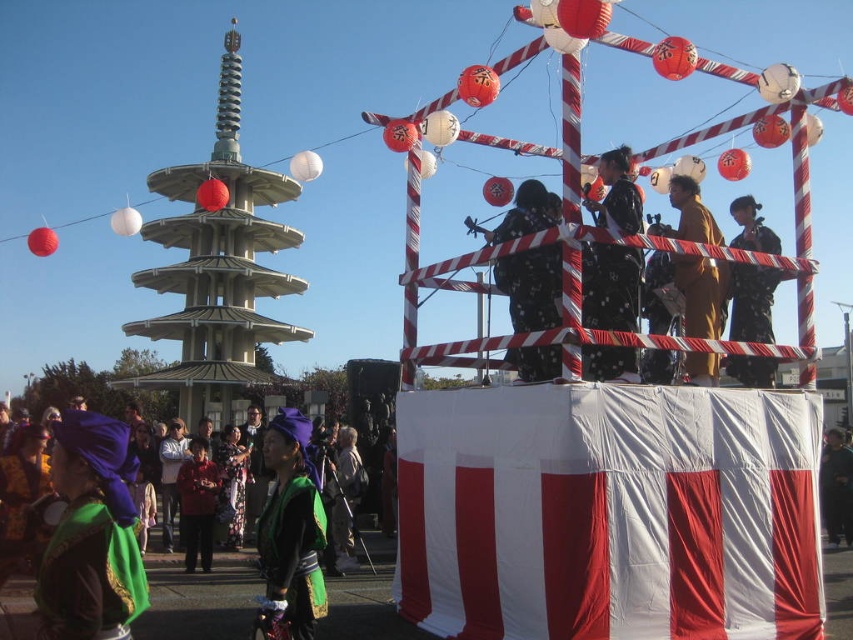
Is red fabric jacket at lower left positioned before dark green fabric at center?

Yes, it is in front of dark green fabric at center.

Does red fabric jacket at lower left have a larger size compared to dark green fabric at center?

No.

Is point (189, 458) positioned in front of point (834, 529)?

No.

You are a GUI agent. You are given a task and a screenshot of the screen. Output one action in this format:
    pyautogui.click(x=<x>, y=<y>)
    Task: Click on the red fabric jacket at lower left
    The height and width of the screenshot is (640, 853).
    Given the screenshot: What is the action you would take?
    pyautogui.click(x=196, y=502)

Is black satin kimono at center shorter than red fabric jacket at lower left?

In fact, black satin kimono at center may be taller than red fabric jacket at lower left.

Does black satin kimono at center have a smaller size compared to red fabric jacket at lower left?

No.

Does point (631, 253) come farther from viewer compared to point (187, 513)?

No, it is not.

The width and height of the screenshot is (853, 640). Find the location of `black satin kimono at center`. black satin kimono at center is located at coordinates (612, 288).

Can you confirm if brown textured kimono at center is smaller than dark gray fabric at center?

Actually, brown textured kimono at center might be larger than dark gray fabric at center.

How far apart are brown textured kimono at center and dark gray fabric at center?

A distance of 34.77 meters exists between brown textured kimono at center and dark gray fabric at center.

Find the location of `brown textured kimono at center`. brown textured kimono at center is located at coordinates (701, 292).